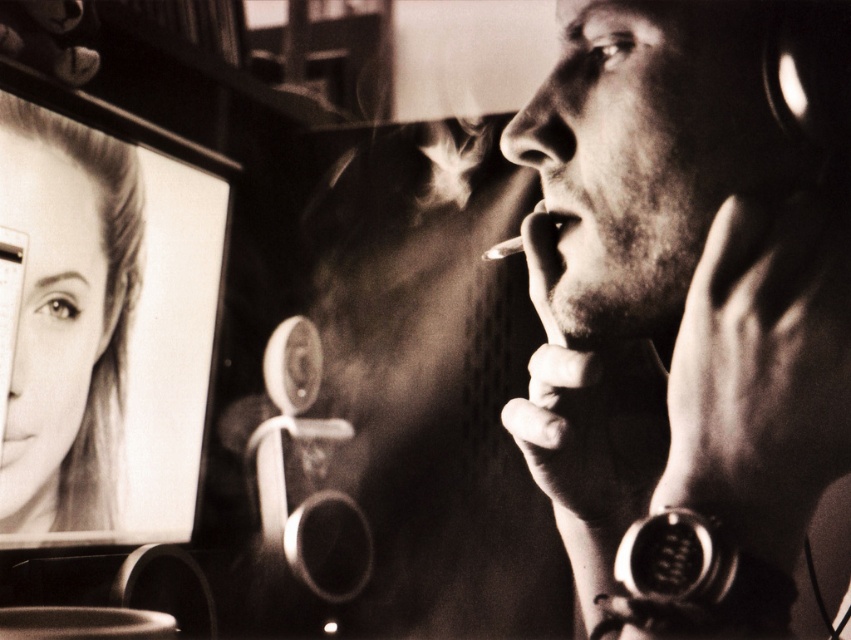
Question: Is smooth skin face at upper left thinner than smooth skin mouth at center?

Choices:
 (A) no
 (B) yes

Answer: (A)

Question: Which of the following is the closest to the observer?

Choices:
 (A) smooth skin face at right
 (B) smooth skin mouth at center
 (C) smooth skin face at upper left

Answer: (A)

Question: Among these points, which one is farthest from the camera?

Choices:
 (A) (780, 388)
 (B) (29, 451)
 (C) (35, 465)

Answer: (C)

Question: Can you confirm if smooth skin face at right is bigger than smooth skin face at upper left?

Choices:
 (A) yes
 (B) no

Answer: (B)

Question: Estimate the real-world distances between objects in this image. Which object is closer to the smooth skin mouth at center?

Choices:
 (A) smooth skin face at upper left
 (B) smooth skin face at right

Answer: (A)

Question: Can you confirm if smooth skin face at right is positioned above smooth skin mouth at center?

Choices:
 (A) yes
 (B) no

Answer: (A)